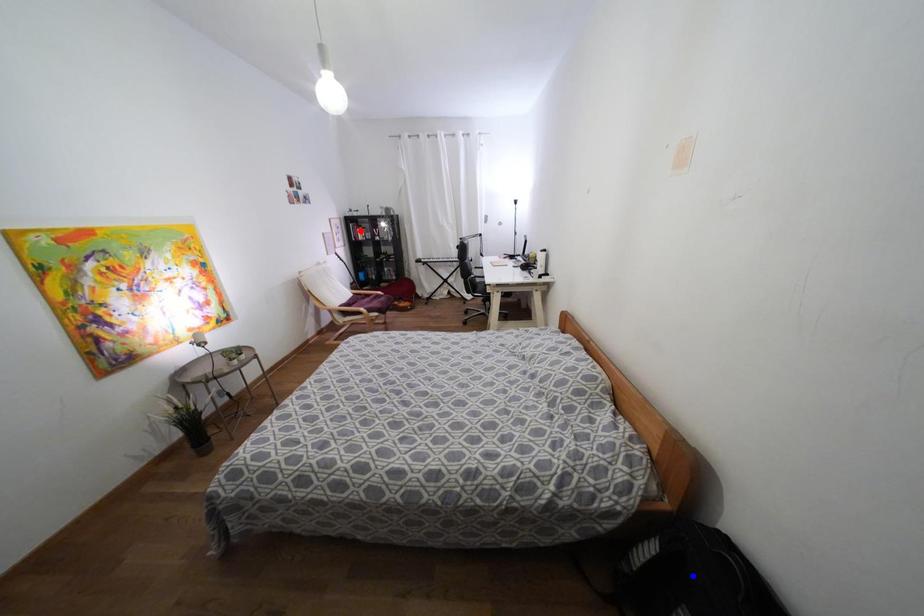
Question: In the image, two points are highlighted. Which point is nearer to the camera? Reply with the corresponding letter.

Choices:
 (A) blue point
 (B) red point

Answer: (A)